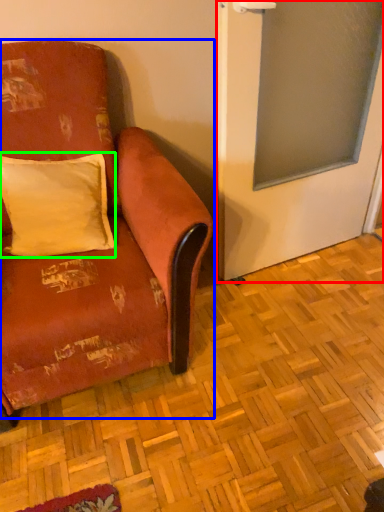
Question: Which object is positioned closest to screen door (highlighted by a red box)? Select from studio couch (highlighted by a blue box) and pillow (highlighted by a green box).

Choices:
 (A) studio couch
 (B) pillow

Answer: (A)